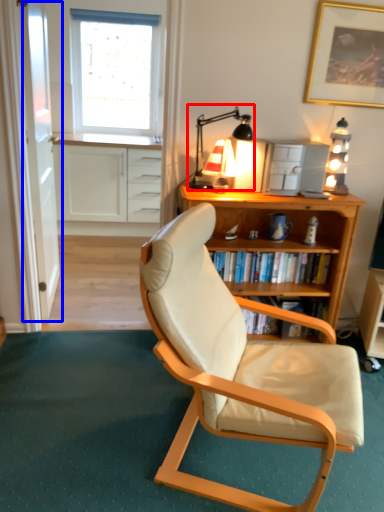
Question: Which of the following is the closest to the observer, table lamp (highlighted by a red box) or glass door (highlighted by a blue box)?

Choices:
 (A) table lamp
 (B) glass door

Answer: (A)